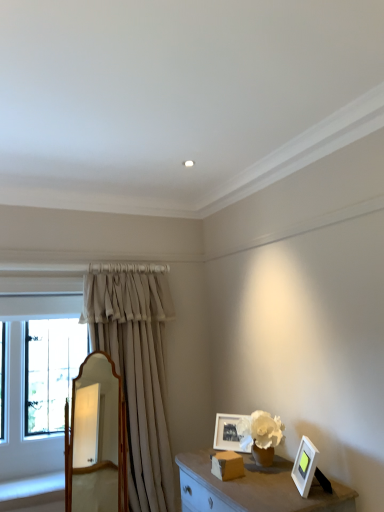
Question: Should I look upward or downward to see matte white picture frame at center, marked as the 2th picture frame in a front-to-back arrangement?

Choices:
 (A) down
 (B) up

Answer: (A)

Question: Is wooden mirror at center completely or partially outside of white matte picture frame at lower right, the 1th picture frame in the right-to-left sequence?

Choices:
 (A) yes
 (B) no

Answer: (A)

Question: Is wooden mirror at center far from white matte picture frame at lower right, the 1th picture frame in the right-to-left sequence?

Choices:
 (A) yes
 (B) no

Answer: (A)

Question: Is wooden mirror at center looking in the opposite direction of white matte picture frame at lower right, the 1th picture frame in the right-to-left sequence?

Choices:
 (A) yes
 (B) no

Answer: (B)

Question: From the image's perspective, is wooden mirror at center above white matte picture frame at lower right, the 1th picture frame in the right-to-left sequence?

Choices:
 (A) no
 (B) yes

Answer: (A)

Question: Is white matte picture frame at lower right, which appears as the second picture frame when viewed from the left, inside wooden mirror at center?

Choices:
 (A) no
 (B) yes

Answer: (A)

Question: Can you confirm if wooden mirror at center is thinner than white matte picture frame at lower right, which appears as the second picture frame when viewed from the left?

Choices:
 (A) yes
 (B) no

Answer: (B)

Question: Is matte white picture frame at center, arranged as the 2th picture frame when viewed from the right, at the right side of beige fabric curtain at left?

Choices:
 (A) yes
 (B) no

Answer: (A)

Question: From the image's perspective, is matte white picture frame at center, marked as the 2th picture frame in a front-to-back arrangement, above beige fabric curtain at left?

Choices:
 (A) yes
 (B) no

Answer: (B)

Question: Can you confirm if matte white picture frame at center, arranged as the 2th picture frame when viewed from the right, is wider than beige fabric curtain at left?

Choices:
 (A) no
 (B) yes

Answer: (A)

Question: Is the position of matte white picture frame at center, the first picture frame in the left-to-right sequence, less distant than that of beige fabric curtain at left?

Choices:
 (A) no
 (B) yes

Answer: (B)

Question: From the image's perspective, is matte white picture frame at center, arranged as the 2th picture frame when viewed from the right, below beige fabric curtain at left?

Choices:
 (A) no
 (B) yes

Answer: (B)

Question: Is matte white picture frame at center, marked as the 2th picture frame in a front-to-back arrangement, surrounding beige fabric curtain at left?

Choices:
 (A) no
 (B) yes

Answer: (A)

Question: Does beige fabric curtain at left have a lesser width compared to white matte picture frame at lower right, the 1th picture frame from the front?

Choices:
 (A) yes
 (B) no

Answer: (B)